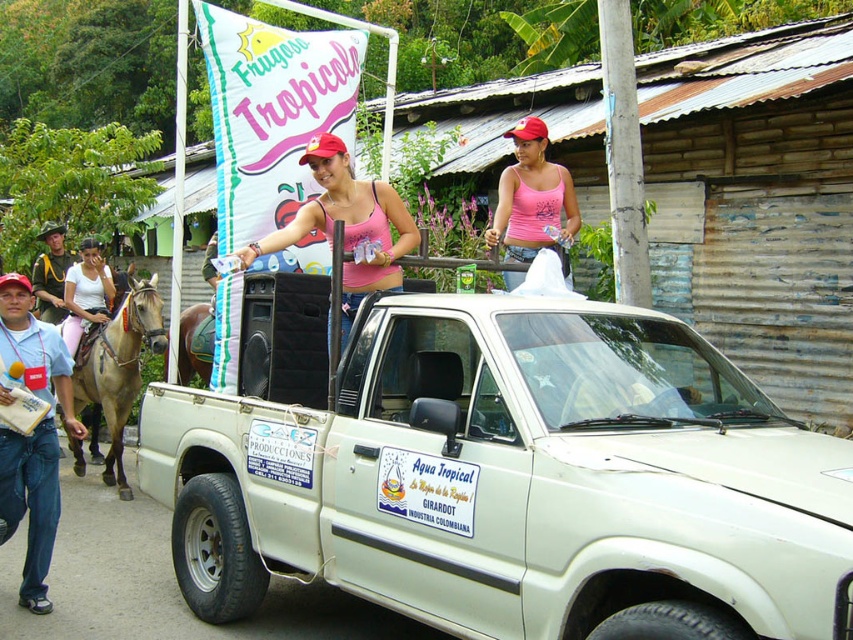
Is white matte shirt at left wider than black uniform at left?

No.

Can you confirm if white matte shirt at left is taller than black uniform at left?

Yes.

Measure the distance between point (x=82, y=292) and camera.

Point (x=82, y=292) and camera are 8.58 meters apart.

Find the location of `white matte shirt at left`. white matte shirt at left is located at coordinates (85, 292).

Between white matte pickup truck at center and blue denim jeans at lower left, which one is positioned higher?

blue denim jeans at lower left is above.

Between white matte pickup truck at center and blue denim jeans at lower left, which one appears on the left side from the viewer's perspective?

Positioned to the left is blue denim jeans at lower left.

I want to click on white matte pickup truck at center, so click(514, 481).

Between blue denim jeans at lower left and pink fabric bikini top at center, which one appears on the left side from the viewer's perspective?

Positioned to the left is blue denim jeans at lower left.

Does blue denim jeans at lower left come in front of pink fabric bikini top at center?

No, it is not.

Identify the location of blue denim jeans at lower left. (33, 435).